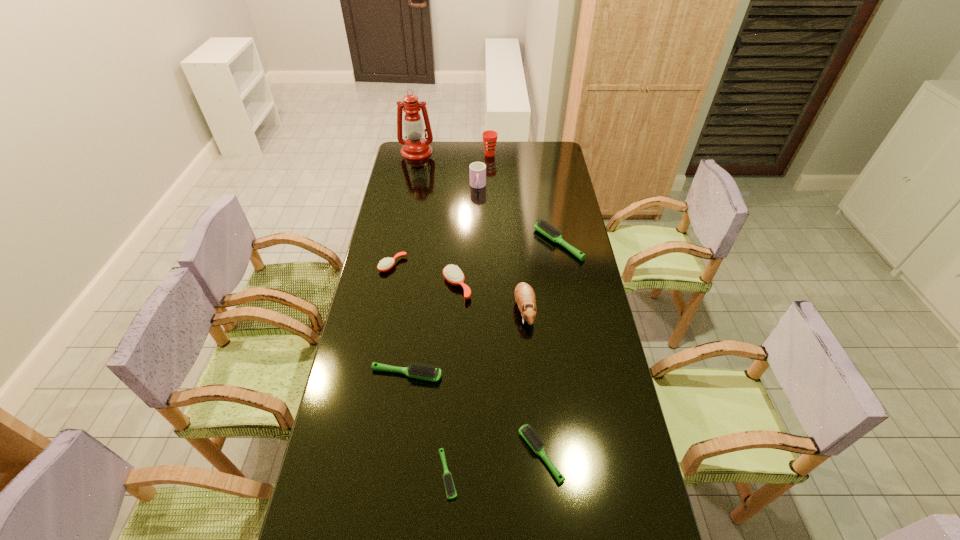
In order to click on the third light hairbrush from left to right in this screenshot , I will do `click(537, 445)`.

The height and width of the screenshot is (540, 960). I want to click on the second smallest light hairbrush, so click(537, 445).

The height and width of the screenshot is (540, 960). I want to click on the second light hairbrush from left to right, so click(449, 486).

Locate an element on the screen. The width and height of the screenshot is (960, 540). the shortest hairbrush is located at coordinates (449, 486).

Identify the location of free space located 0.160m on the front of the tallest object. The image size is (960, 540). (412, 178).

The width and height of the screenshot is (960, 540). I want to click on vacant point located 0.060m on the left of the farther cup, so click(x=470, y=154).

You are a GUI agent. You are given a task and a screenshot of the screen. Output one action in this format:
    pyautogui.click(x=<x>, y=<y>)
    Task: Click on the vacant space situated with the handle on the side of the nearer cup
    
    Given the screenshot: What is the action you would take?
    pyautogui.click(x=478, y=201)

The height and width of the screenshot is (540, 960). What are the coordinates of `free location located at the face of the hamster` in the screenshot? It's located at (531, 386).

Where is `vacant region located on the front of the bigger orange hairbrush`? Image resolution: width=960 pixels, height=540 pixels. vacant region located on the front of the bigger orange hairbrush is located at coordinates (454, 348).

Find the location of a particular element. This screenshot has width=960, height=540. free location located 0.190m on the back of the rightmost hairbrush is located at coordinates (550, 200).